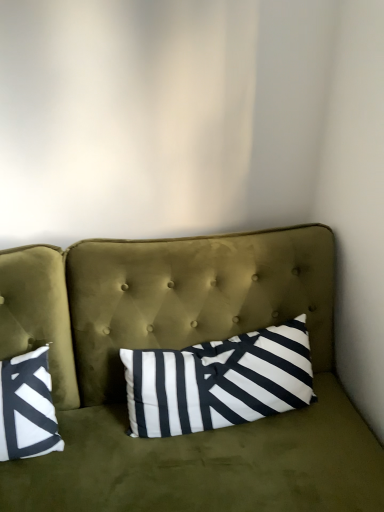
Question: From a real-world perspective, is white striped pillow at center above or below olive green velvet couch at center?

Choices:
 (A) above
 (B) below

Answer: (A)

Question: Is point (221, 391) positioned closer to the camera than point (61, 355)?

Choices:
 (A) closer
 (B) farther

Answer: (A)

Question: Considering their positions, is white striped pillow at center located in front of or behind olive green velvet couch at center?

Choices:
 (A) front
 (B) behind

Answer: (B)

Question: From a real-world perspective, relative to white striped pillow at center, is olive green velvet couch at center vertically above or below?

Choices:
 (A) below
 (B) above

Answer: (A)

Question: In terms of size, does olive green velvet couch at center appear bigger or smaller than white striped pillow at center?

Choices:
 (A) small
 (B) big

Answer: (B)

Question: Does point (24, 287) appear closer or farther from the camera than point (173, 415)?

Choices:
 (A) farther
 (B) closer

Answer: (A)

Question: In the image, is olive green velvet couch at center positioned in front of or behind white striped pillow at center?

Choices:
 (A) front
 (B) behind

Answer: (A)